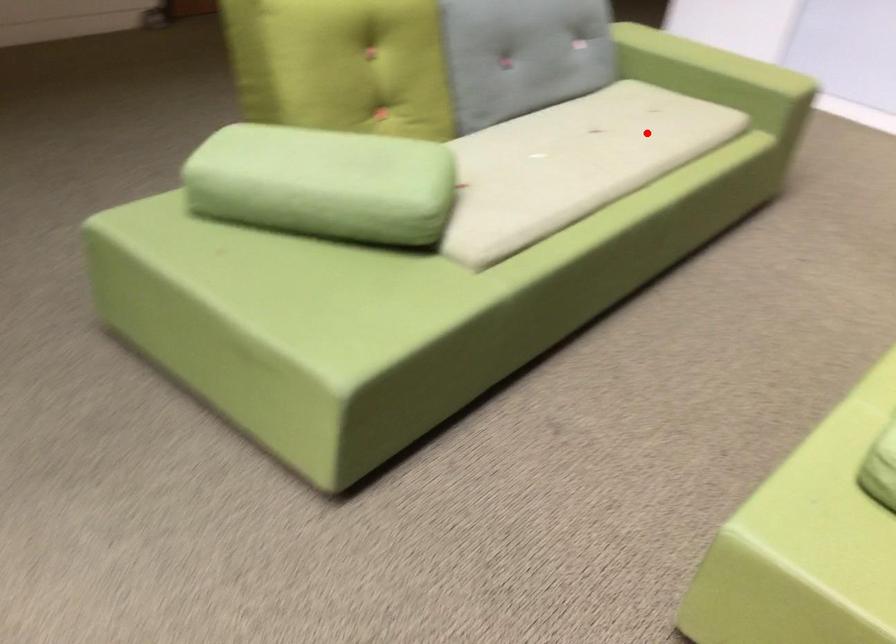
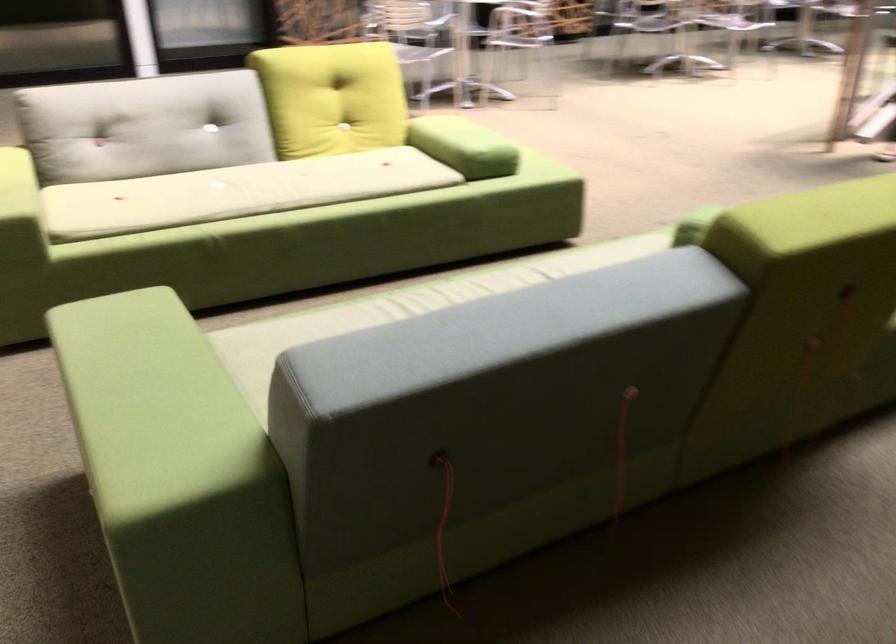
The point at the highlighted location is marked in the first image. Where is the corresponding point in the second image?

(401, 308)